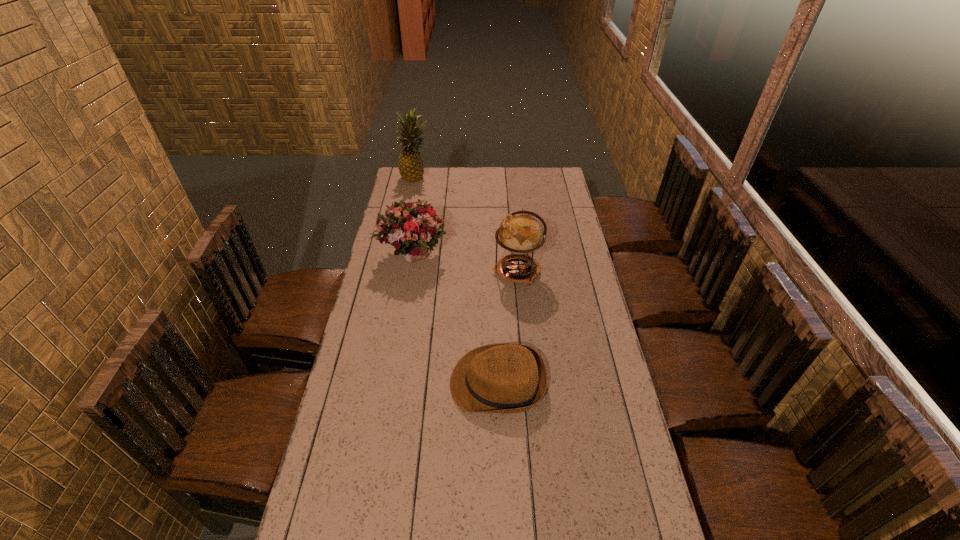
In the image, there is a desktop. Where is `vacant space at the right edge`? This screenshot has height=540, width=960. vacant space at the right edge is located at coordinates (575, 266).

The width and height of the screenshot is (960, 540). In the image, there is a desktop. Identify the location of vacant space at the far left corner. pos(398,181).

Locate an element on the screen. This screenshot has height=540, width=960. free area in between the globe and the farthest object is located at coordinates (467, 224).

Locate an element on the screen. This screenshot has width=960, height=540. unoccupied area between the bouquet and the third shortest object is located at coordinates (465, 264).

Where is `vacant space that's between the nearest object and the second tallest object`? The image size is (960, 540). vacant space that's between the nearest object and the second tallest object is located at coordinates (508, 327).

Where is `free space between the shortest object and the third tallest object`? The image size is (960, 540). free space between the shortest object and the third tallest object is located at coordinates (455, 319).

Select which object appears as the closest to the fedora. Please provide its 2D coordinates. Your answer should be formatted as a tuple, i.e. [(x, y)], where the tuple contains the x and y coordinates of a point satisfying the conditions above.

[(520, 232)]

In order to click on object that is the second closest one to the globe in this screenshot , I will do point(499,378).